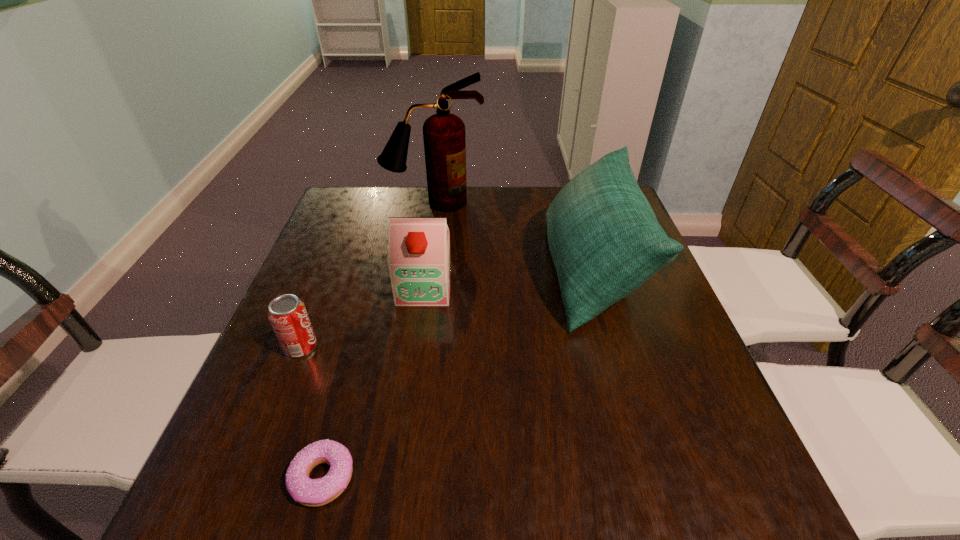
What are the coordinates of `free space located 0.100m on the front-facing side of the rightmost object` in the screenshot? It's located at (506, 271).

The height and width of the screenshot is (540, 960). I want to click on vacant space situated 0.220m on the front-facing side of the rightmost object, so click(x=460, y=271).

Find the location of `vacant space located on the front-facing side of the rightmost object`. vacant space located on the front-facing side of the rightmost object is located at coordinates (483, 271).

Find the location of `free space located 0.150m with the cap open on the third tallest object`. free space located 0.150m with the cap open on the third tallest object is located at coordinates (415, 356).

Locate an element on the screen. The width and height of the screenshot is (960, 540). free location located on the back of the soda can is located at coordinates (312, 318).

Find the location of `free space located on the right of the nearest object`. free space located on the right of the nearest object is located at coordinates (551, 477).

Locate an element on the screen. Image resolution: width=960 pixels, height=540 pixels. fire extinguisher that is at the far edge is located at coordinates (444, 138).

The height and width of the screenshot is (540, 960). In order to click on cushion present at the far edge in this screenshot , I will do `click(605, 241)`.

The width and height of the screenshot is (960, 540). In order to click on object situated at the near edge in this screenshot , I will do `click(310, 492)`.

This screenshot has height=540, width=960. I want to click on fire extinguisher situated at the left edge, so click(444, 138).